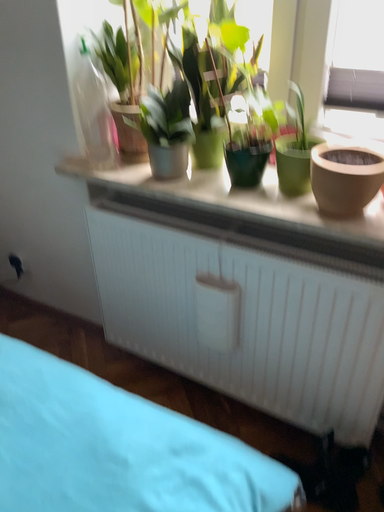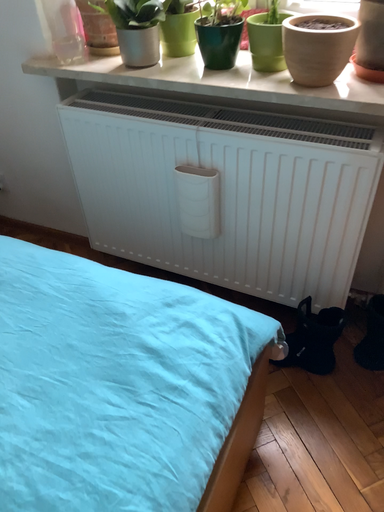
Question: Which way did the camera rotate in the video?

Choices:
 (A) rotated upward
 (B) rotated downward

Answer: (B)